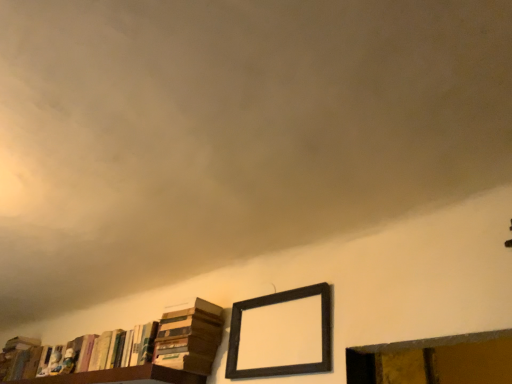
Question: Is hardcover books at lower left, the 2th book viewed from the right, inside dark wood picture frame at upper center?

Choices:
 (A) no
 (B) yes

Answer: (A)

Question: Could you tell me if dark wood picture frame at upper center is facing hardcover books at lower left, the 2th book viewed from the right?

Choices:
 (A) yes
 (B) no

Answer: (B)

Question: From the image's perspective, is dark wood picture frame at upper center on top of hardcover books at lower left, which is the second book from left to right?

Choices:
 (A) yes
 (B) no

Answer: (A)

Question: Does dark wood picture frame at upper center have a larger size compared to hardcover books at lower left, which is the second book from left to right?

Choices:
 (A) yes
 (B) no

Answer: (B)

Question: Is dark wood picture frame at upper center at the left side of hardcover books at lower left, which is the second book from left to right?

Choices:
 (A) no
 (B) yes

Answer: (A)

Question: Can you confirm if dark wood picture frame at upper center is thinner than hardcover books at lower left, the 2th book viewed from the right?

Choices:
 (A) yes
 (B) no

Answer: (A)

Question: From a real-world perspective, is hardcover books at lower left, the 2th book viewed from the right, on hardcover books at lower left, the 3th book positioned from the left?

Choices:
 (A) no
 (B) yes

Answer: (A)

Question: Does hardcover books at lower left, the 2th book viewed from the right, touch hardcover books at lower left, marked as the 1th book in a right-to-left arrangement?

Choices:
 (A) yes
 (B) no

Answer: (B)

Question: Is hardcover books at lower left, the 2th book viewed from the right, at the right side of hardcover books at lower left, marked as the 1th book in a right-to-left arrangement?

Choices:
 (A) yes
 (B) no

Answer: (B)

Question: Is hardcover books at lower left, marked as the 1th book in a right-to-left arrangement, completely or partially inside hardcover books at lower left, which is the second book from left to right?

Choices:
 (A) yes
 (B) no

Answer: (B)

Question: From the image's perspective, is hardcover books at lower left, which is the second book from left to right, above hardcover books at lower left, the 3th book positioned from the left?

Choices:
 (A) no
 (B) yes

Answer: (A)

Question: Does hardcover books at lower left, the 2th book viewed from the right, have a greater width compared to hardcover books at lower left, the 3th book positioned from the left?

Choices:
 (A) yes
 (B) no

Answer: (B)

Question: Does dark wood picture frame at upper center have a lesser width compared to hardcover book at lower left, which appears as the third book when viewed from the right?

Choices:
 (A) yes
 (B) no

Answer: (A)